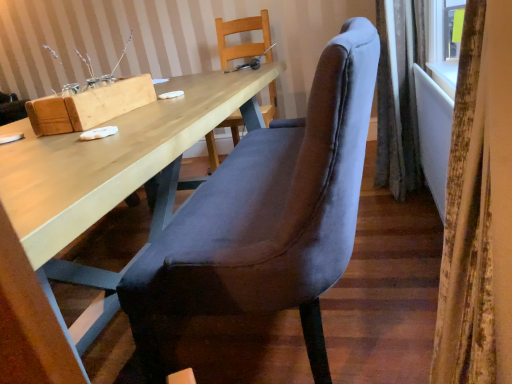
How much space does velvet grey chair at center, positioned as the 1th chair in front-to-back order, occupy vertically?

The height of velvet grey chair at center, positioned as the 1th chair in front-to-back order, is 37.31 inches.

Where is `velvet gray curtain at right, the second curtain positioned from the left`? This screenshot has width=512, height=384. velvet gray curtain at right, the second curtain positioned from the left is located at coordinates (399, 95).

Is point (454, 25) more distant than point (223, 60)?

That is False.

How far apart are transparent glass window at upper right and wooden chair at upper center, acting as the 2th chair starting from the front?

transparent glass window at upper right is 1.38 meters from wooden chair at upper center, acting as the 2th chair starting from the front.

Who is bigger, transparent glass window at upper right or wooden chair at upper center, acting as the 2th chair starting from the front?

With larger size is wooden chair at upper center, acting as the 2th chair starting from the front.

Is transparent glass window at upper right not near wooden chair at upper center, marked as the first chair in a back-to-front arrangement?

Indeed, transparent glass window at upper right is not near wooden chair at upper center, marked as the first chair in a back-to-front arrangement.

Would you say velvet grey chair at center, positioned as the 1th chair in front-to-back order, is part of matte wood desk at center's contents?

No, velvet grey chair at center, positioned as the 1th chair in front-to-back order, is located outside of matte wood desk at center.

Does matte wood desk at center have a greater height compared to velvet grey chair at center, positioned as the 1th chair in front-to-back order?

In fact, matte wood desk at center may be shorter than velvet grey chair at center, positioned as the 1th chair in front-to-back order.

Is matte wood desk at center turned away from velvet grey chair at center, positioned as the 1th chair in front-to-back order?

Yes, matte wood desk at center is positioned with its back facing velvet grey chair at center, positioned as the 1th chair in front-to-back order.

From a real-world perspective, does matte wood desk at center sit lower than velvet grey chair at center, the 2th chair positioned from the back?

Yes, from a real-world perspective, matte wood desk at center is under velvet grey chair at center, the 2th chair positioned from the back.

Does velvet gray curtain at right, which appears as the 1th curtain when viewed from the right, lie in front of transparent glass window at upper right?

No, the depth of velvet gray curtain at right, which appears as the 1th curtain when viewed from the right, is greater than that of transparent glass window at upper right.

From the image's perspective, is velvet gray curtain at right, which appears as the 1th curtain when viewed from the right, over transparent glass window at upper right?

No, from the image's perspective, velvet gray curtain at right, which appears as the 1th curtain when viewed from the right, is not on top of transparent glass window at upper right.

Which is more to the right, velvet gray curtain at right, positioned as the second curtain in front-to-back order, or transparent glass window at upper right?

Positioned to the right is transparent glass window at upper right.

Based on their sizes in the image, would you say velvet gray curtain at right, which appears as the 1th curtain when viewed from the right, is bigger or smaller than transparent glass window at upper right?

Clearly, velvet gray curtain at right, which appears as the 1th curtain when viewed from the right, is larger in size than transparent glass window at upper right.

From the image's perspective, who appears lower, wooden chair at upper center, acting as the 2th chair starting from the front, or velvet grey chair at center, the 2th chair positioned from the back?

From the image's view, velvet grey chair at center, the 2th chair positioned from the back, is below.

This screenshot has width=512, height=384. Find the location of `chair in front of the wooden chair at upper center, marked as the first chair in a back-to-front arrangement`. chair in front of the wooden chair at upper center, marked as the first chair in a back-to-front arrangement is located at coordinates (268, 215).

Consider the image. Which is farther, (x=244, y=55) or (x=230, y=314)?

Point (x=244, y=55)

Consider the image. Is velvet grey chair at center, positioned as the 1th chair in front-to-back order, at the back of wooden chair at upper center, marked as the first chair in a back-to-front arrangement?

No, wooden chair at upper center, marked as the first chair in a back-to-front arrangement, is not facing the opposite direction of velvet grey chair at center, positioned as the 1th chair in front-to-back order.

Is wooden chair at upper center, marked as the first chair in a back-to-front arrangement, facing away from velvet curtain at right, which ranks as the 2th curtain in back-to-front order?

wooden chair at upper center, marked as the first chair in a back-to-front arrangement, is not turned away from velvet curtain at right, which ranks as the 2th curtain in back-to-front order.

Is point (234, 138) farther from viewer compared to point (473, 259)?

Yes, it is behind point (473, 259).

Between wooden chair at upper center, marked as the first chair in a back-to-front arrangement, and velvet curtain at right, which is the 1th curtain in left-to-right order, which one appears on the right side from the viewer's perspective?

velvet curtain at right, which is the 1th curtain in left-to-right order.

Is wooden chair at upper center, marked as the first chair in a back-to-front arrangement, smaller than velvet curtain at right, the 1th curtain when ordered from front to back?

Actually, wooden chair at upper center, marked as the first chair in a back-to-front arrangement, might be larger than velvet curtain at right, the 1th curtain when ordered from front to back.

Is the depth of wooden chair at upper center, marked as the first chair in a back-to-front arrangement, greater than that of matte wood desk at center?

Yes, the depth of wooden chair at upper center, marked as the first chair in a back-to-front arrangement, is greater than that of matte wood desk at center.

Is wooden chair at upper center, marked as the first chair in a back-to-front arrangement, positioned far away from matte wood desk at center?

No, wooden chair at upper center, marked as the first chair in a back-to-front arrangement, is in close proximity to matte wood desk at center.

Considering the sizes of objects wooden chair at upper center, acting as the 2th chair starting from the front, and matte wood desk at center in the image provided, who is bigger, wooden chair at upper center, acting as the 2th chair starting from the front, or matte wood desk at center?

matte wood desk at center.

From a real-world perspective, which is physically below, wooden chair at upper center, acting as the 2th chair starting from the front, or matte wood desk at center?

From a 3D spatial view, matte wood desk at center is below.

Who is taller, velvet grey chair at center, the 2th chair positioned from the back, or transparent glass window at upper right?

velvet grey chair at center, the 2th chair positioned from the back, is taller.

Can you confirm if velvet grey chair at center, positioned as the 1th chair in front-to-back order, is wider than transparent glass window at upper right?

Yes, velvet grey chair at center, positioned as the 1th chair in front-to-back order, is wider than transparent glass window at upper right.

Does velvet grey chair at center, the 2th chair positioned from the back, turn towards transparent glass window at upper right?

No, velvet grey chair at center, the 2th chair positioned from the back, is not oriented towards transparent glass window at upper right.

Would you say velvet grey chair at center, the 2th chair positioned from the back, is outside transparent glass window at upper right?

Yes.

Find the location of a particular element. the 1st chair positioned below the transparent glass window at upper right (from a real-world perspective) is located at coordinates (241, 32).

Where is `the 1st chair behind the matte wood desk at center`? The image size is (512, 384). the 1st chair behind the matte wood desk at center is located at coordinates (268, 215).

From the image, which object appears to be farther from velvet curtain at right, which is the 1th curtain in left-to-right order, wooden chair at upper center, acting as the 2th chair starting from the front, or velvet grey chair at center, the 2th chair positioned from the back?

Based on the image, wooden chair at upper center, acting as the 2th chair starting from the front, appears to be further to velvet curtain at right, which is the 1th curtain in left-to-right order.

From the image, which object appears to be nearer to transparent glass window at upper right, wooden chair at upper center, acting as the 2th chair starting from the front, or velvet curtain at right, which ranks as the 2th curtain in back-to-front order?

velvet curtain at right, which ranks as the 2th curtain in back-to-front order, lies closer to transparent glass window at upper right than the other object.

From the image, which object appears to be nearer to matte wood desk at center, velvet grey chair at center, the 2th chair positioned from the back, or velvet curtain at right, placed as the second curtain when sorted from right to left?

Based on the image, velvet grey chair at center, the 2th chair positioned from the back, appears to be nearer to matte wood desk at center.

From the image, which object appears to be farther from velvet curtain at right, the 1th curtain when ordered from front to back, wooden chair at upper center, acting as the 2th chair starting from the front, or matte wood desk at center?

wooden chair at upper center, acting as the 2th chair starting from the front.

Which object lies further to the anchor point velvet grey chair at center, the 2th chair positioned from the back, matte wood desk at center or transparent glass window at upper right?

transparent glass window at upper right.

When comparing their distances from transparent glass window at upper right, does matte wood desk at center or velvet gray curtain at right, placed as the 1th curtain when sorted from back to front, seem closer?

The object closer to transparent glass window at upper right is velvet gray curtain at right, placed as the 1th curtain when sorted from back to front.

Which object lies nearer to the anchor point velvet grey chair at center, positioned as the 1th chair in front-to-back order, velvet gray curtain at right, placed as the 1th curtain when sorted from back to front, or matte wood desk at center?

matte wood desk at center is closer to velvet grey chair at center, positioned as the 1th chair in front-to-back order.

When comparing their distances from velvet curtain at right, placed as the second curtain when sorted from right to left, does velvet gray curtain at right, the second curtain positioned from the left, or wooden chair at upper center, acting as the 2th chair starting from the front, seem further?

Among the two, wooden chair at upper center, acting as the 2th chair starting from the front, is located further to velvet curtain at right, placed as the second curtain when sorted from right to left.

This screenshot has width=512, height=384. What are the coordinates of `curtain between velvet curtain at right, the 1th curtain when ordered from front to back, and wooden chair at upper center, acting as the 2th chair starting from the front, from front to back` in the screenshot? It's located at (399, 95).

Image resolution: width=512 pixels, height=384 pixels. I want to click on window between matte wood desk at center and wooden chair at upper center, acting as the 2th chair starting from the front, from front to back, so click(452, 27).

Locate an element on the screen. Image resolution: width=512 pixels, height=384 pixels. chair located between matte wood desk at center and velvet gray curtain at right, positioned as the second curtain in front-to-back order, in the depth direction is located at coordinates (268, 215).

Locate an element on the screen. window between velvet grey chair at center, the 2th chair positioned from the back, and wooden chair at upper center, marked as the first chair in a back-to-front arrangement, along the z-axis is located at coordinates (452, 27).